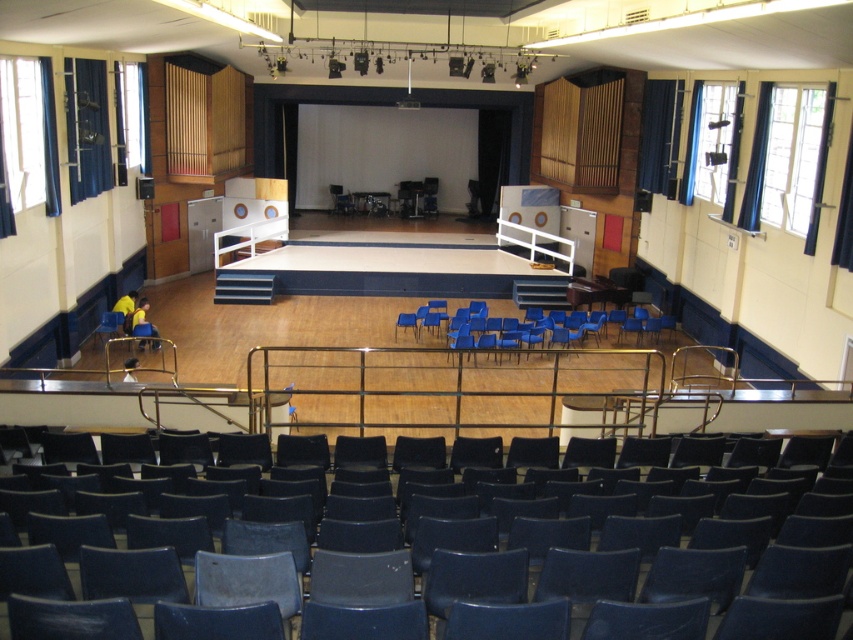
You are an event organizer planning to place a large banner on the stage. The banner requires a secure mounting point. Given the location of the matte blue chair at center, where on the stage would you recommend placing the banner to ensure it is visible to all attendees?

Since the matte blue chair at center is located at point (x=798, y=576), the banner should be placed centrally on the stage to ensure visibility from all seating areas, including the matte blue chair at center.

You are an event organizer planning to move a 2.5 meter wide banner between the blue plastic chairs at center and the blue plastic chair at lower left. Can the banner fit through the space between them?

The distance between the blue plastic chairs at center and the blue plastic chair at lower left is 7.10 meters. Since the banner is only 2.5 meters wide, it can easily fit through the space between them.